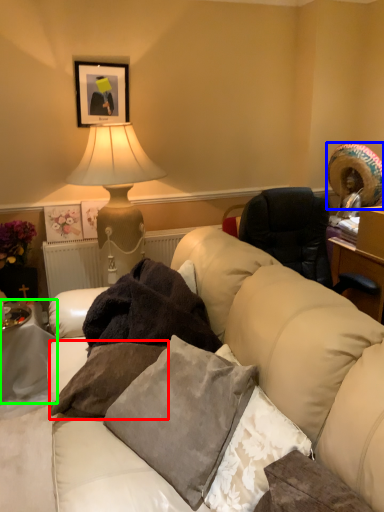
Question: Estimate the real-world distances between objects in this image. Which object is farther from pillow (highlighted by a red box), straw hat (highlighted by a blue box) or table (highlighted by a green box)?

Choices:
 (A) straw hat
 (B) table

Answer: (A)